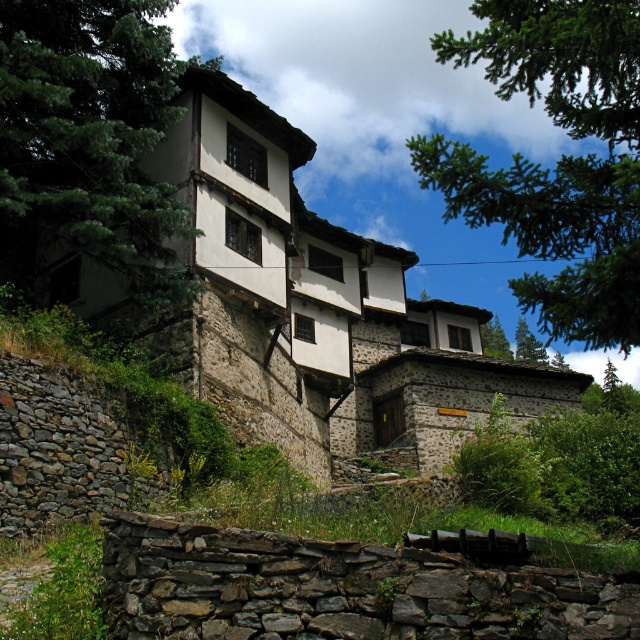
You are standing at the camera position and want to reach point (x=72, y=200). Is the distance more than 40 meters?

Yes, the distance between the camera and point (x=72, y=200) is 40.70 meters, which is more than 40 meters.

You are standing in front of the traditional stone house and notice two green leafy trees in the upper part of the image. Which tree is closer to you, the green leafy tree at upper center or the green leafy tree at upper left?

The green leafy tree at upper center is closer to you because it is in front of the green leafy tree at upper left.